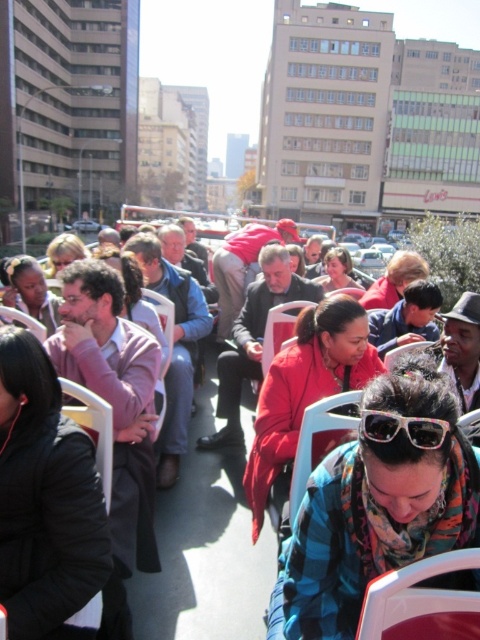
Which of these two, matte black jacket at center or black plastic sunglasses at center, stands shorter?

With less height is black plastic sunglasses at center.

Between matte black jacket at center and black plastic sunglasses at center, which one is positioned higher?

Positioned higher is black plastic sunglasses at center.

Is point (158, 531) positioned after point (443, 420)?

Yes, point (158, 531) is behind point (443, 420).

You are a GUI agent. You are given a task and a screenshot of the screen. Output one action in this format:
    pyautogui.click(x=<x>, y=<y>)
    Task: Click on the matte black jacket at center
    
    Given the screenshot: What is the action you would take?
    pyautogui.click(x=206, y=541)